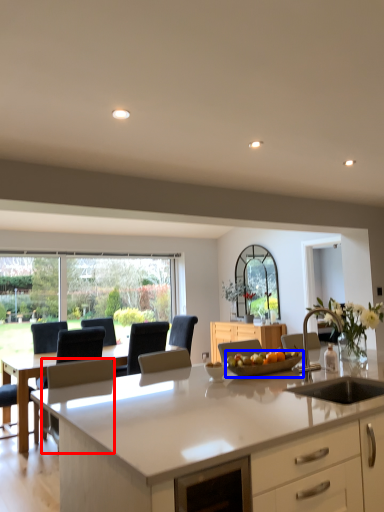
Question: Which object is closer to the camera taking this photo, armchair (highlighted by a red box) or tray (highlighted by a blue box)?

Choices:
 (A) armchair
 (B) tray

Answer: (B)